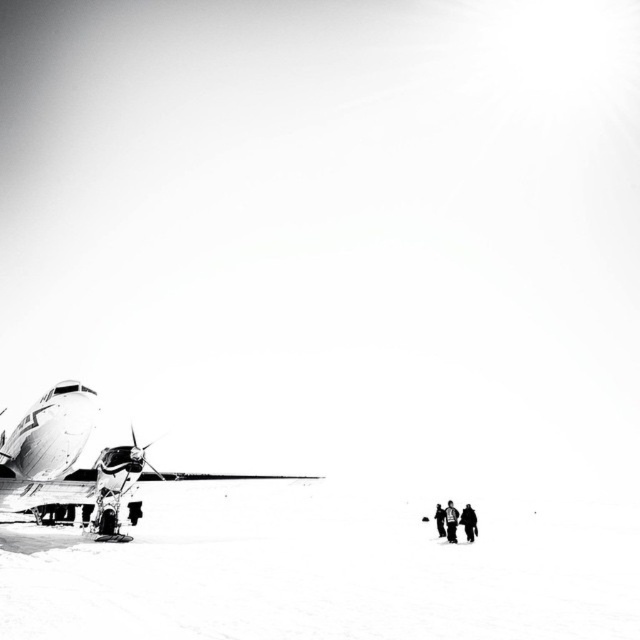
You are a photographer standing at the center of the scene. You want to take a photo that includes both the metallic airplane at left and the snowboarder at lower right. Since the camera has a limited field of view, will you need to zoom out to include both subjects in the frame?

The metallic airplane at left is 37.36 feet away from the snowboarder at lower right. To include both in the frame, you would need to zoom out because the distance between them requires a wider angle to capture both subjects simultaneously.

You are a photographer analyzing this black and white photo. You notice the metallic airplane at left and the snowboarder at lower right. Based on their positions and sizes in the frame, which object appears larger?

The metallic airplane at left appears larger because it is taller than the snowboarder at lower right.

You are a photographer reviewing this black and white image. You notice two jackets in the lower right corner. Which jacket would appear larger in the photo, the dark gray jacket at lower right or the black fabric jacket at lower right?

The dark gray jacket at lower right is closer to the viewer than the black fabric jacket at lower right, so it would appear larger in the photo.